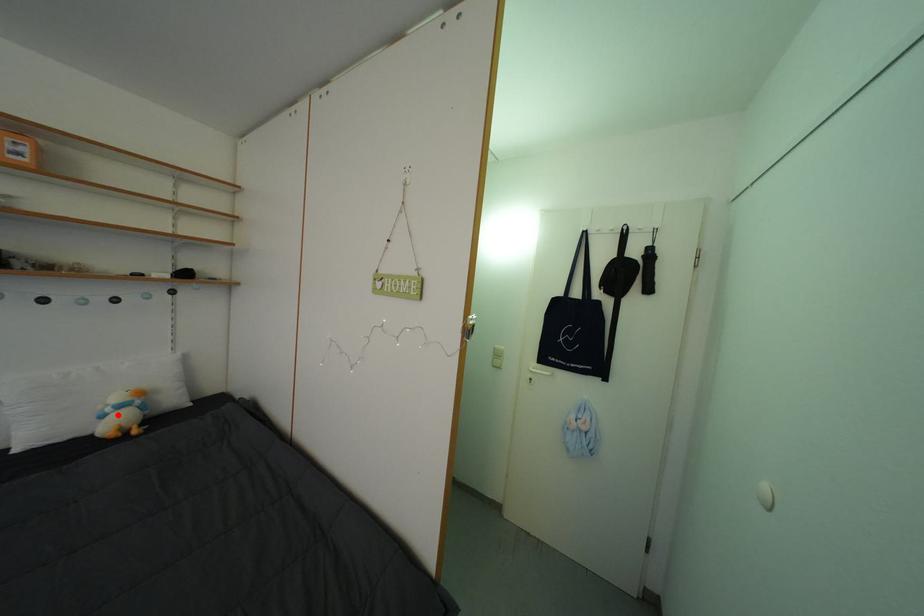
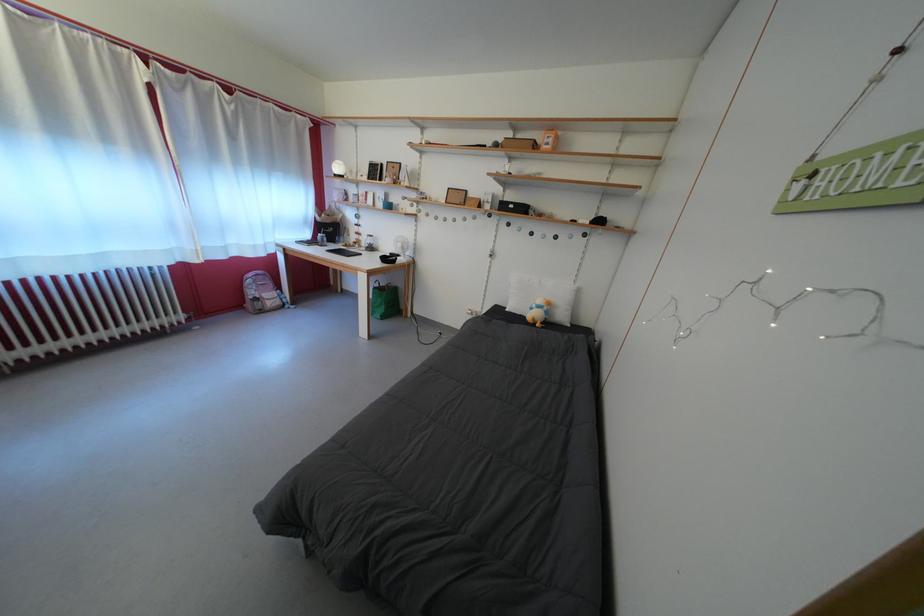
Question: I am providing you with two images of the same scene from different viewpoints. A red point is shown in image1. For the corresponding object point in image2, is it positioned nearer or farther from the camera?

Choices:
 (A) Nearer
 (B) Farther

Answer: (B)